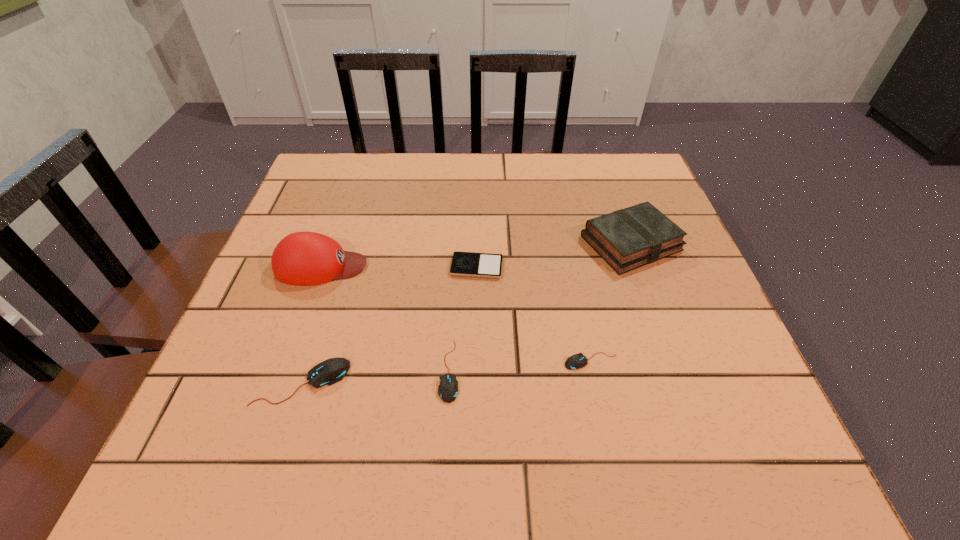
You are a GUI agent. You are given a task and a screenshot of the screen. Output one action in this format:
    pyautogui.click(x=<x>, y=<y>)
    Task: Click on the vacant space that's between the second shortest mouse and the iPod
    
    Given the screenshot: What is the action you would take?
    pyautogui.click(x=463, y=319)

You are a GUI agent. You are given a task and a screenshot of the screen. Output one action in this format:
    pyautogui.click(x=<x>, y=<y>)
    Task: Click on the unoccupied area between the shortest mouse and the tallest object
    
    Given the screenshot: What is the action you would take?
    [456, 313]

In order to click on vacant region between the second mouse from left to right and the fourth shortest object in this screenshot , I will do `click(375, 376)`.

You are a GUI agent. You are given a task and a screenshot of the screen. Output one action in this format:
    pyautogui.click(x=<x>, y=<y>)
    Task: Click on the free space between the second shortest object and the leftmost mouse
    This screenshot has width=960, height=540.
    Given the screenshot: What is the action you would take?
    pyautogui.click(x=446, y=372)

You are a GUI agent. You are given a task and a screenshot of the screen. Output one action in this format:
    pyautogui.click(x=<x>, y=<y>)
    Task: Click on the vacant region between the third shortest object and the baseball cap
    This screenshot has height=540, width=960.
    Given the screenshot: What is the action you would take?
    pyautogui.click(x=385, y=319)

At what (x,y) coordinates should I click in order to perform the action: click on free space that is in between the second shortest object and the third tallest object. Please return your answer as a coordinate pair (x, y). Looking at the image, I should click on (446, 372).

Locate an element on the screen. This screenshot has width=960, height=540. empty space between the book and the iPod is located at coordinates (554, 255).

Locate an element on the screen. Image resolution: width=960 pixels, height=540 pixels. the fourth closest object to the leftmost mouse is located at coordinates (576, 361).

Identify the location of object that is the third nearest to the tallest mouse. (469, 264).

Image resolution: width=960 pixels, height=540 pixels. I want to click on mouse object that ranks as the closest to the fourth tallest object, so click(x=333, y=370).